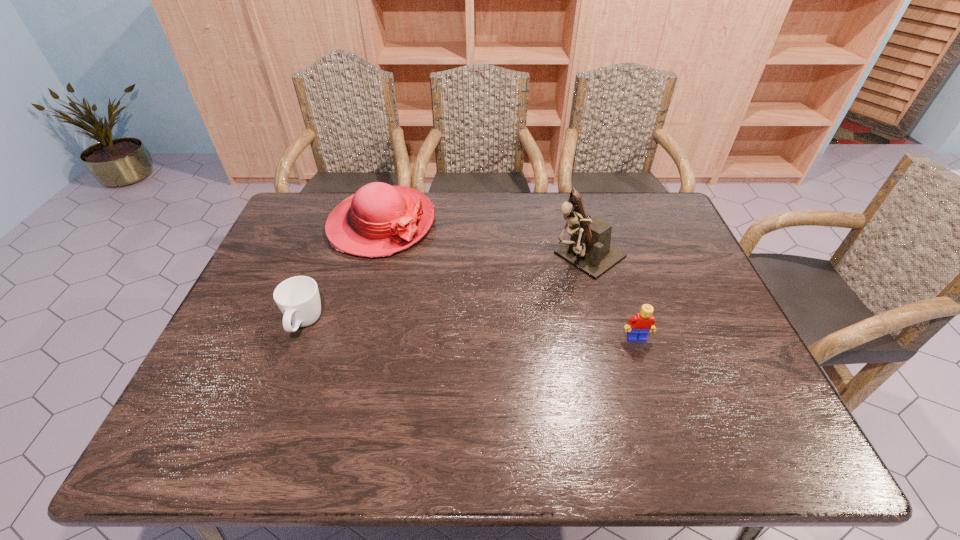
Image resolution: width=960 pixels, height=540 pixels. I want to click on blank space located at the front of the hat with a bow, so click(420, 268).

Where is `vacant space located at the front of the hat with a bow`? This screenshot has height=540, width=960. vacant space located at the front of the hat with a bow is located at coordinates (439, 288).

Identify the location of figurine that is positioned at the far edge. The width and height of the screenshot is (960, 540). (589, 250).

I want to click on hat present at the far edge, so click(x=379, y=220).

This screenshot has height=540, width=960. In order to click on cup that is at the left edge in this screenshot , I will do `click(298, 298)`.

Image resolution: width=960 pixels, height=540 pixels. I want to click on hat located in the left edge section of the desktop, so click(x=379, y=220).

Where is `object positioned at the far left corner`? The width and height of the screenshot is (960, 540). object positioned at the far left corner is located at coordinates (379, 220).

You are a GUI agent. You are given a task and a screenshot of the screen. Output one action in this format:
    pyautogui.click(x=<x>, y=<y>)
    Task: Click on the vacant region at the far edge
    The width and height of the screenshot is (960, 540).
    Given the screenshot: What is the action you would take?
    pyautogui.click(x=455, y=232)

Identify the location of free space at the near edge of the desktop. The image size is (960, 540). (454, 394).

The height and width of the screenshot is (540, 960). In order to click on free location at the left edge of the desktop in this screenshot , I will do `click(316, 256)`.